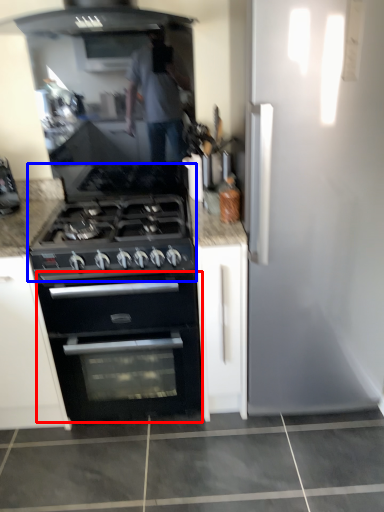
Question: Which object is further to the camera taking this photo, oven (highlighted by a red box) or gas stove (highlighted by a blue box)?

Choices:
 (A) oven
 (B) gas stove

Answer: (A)